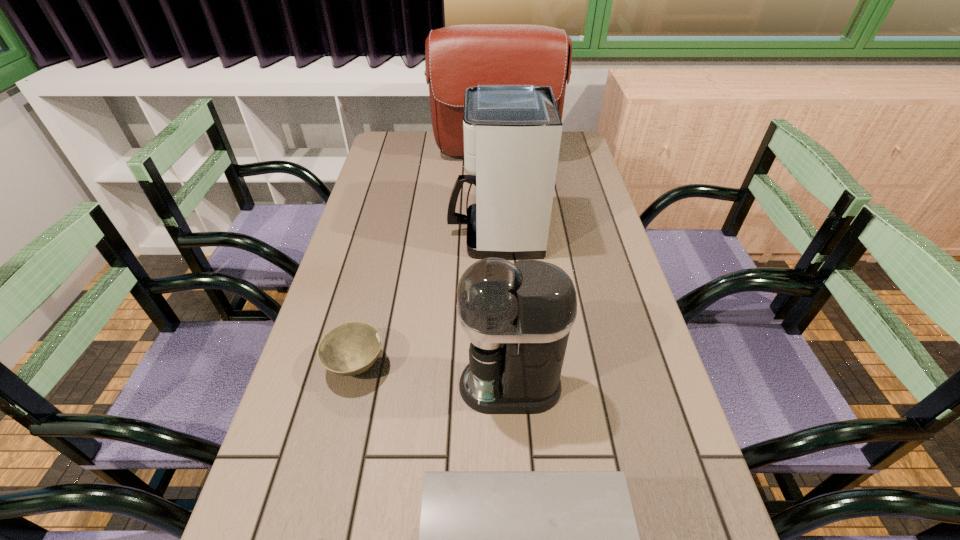
Find the location of a particular element. free region located on the front panel of the tallest coffee maker is located at coordinates (432, 235).

Locate an element on the screen. vacant space located place cup under the spout of the second tallest coffee maker is located at coordinates (356, 386).

Where is `vacant space located place cup under the spout of the second tallest coffee maker`? vacant space located place cup under the spout of the second tallest coffee maker is located at coordinates (403, 386).

This screenshot has width=960, height=540. What are the coordinates of `vacant space located place cup under the spout of the second tallest coffee maker` in the screenshot? It's located at (328, 386).

I want to click on vacant space located on the right of the bowl, so click(x=431, y=366).

The image size is (960, 540). Find the location of `object located at the far edge`. object located at the far edge is located at coordinates (457, 57).

The width and height of the screenshot is (960, 540). Find the location of `object that is at the left edge`. object that is at the left edge is located at coordinates (351, 348).

You are a GUI agent. You are given a task and a screenshot of the screen. Output one action in this format:
    pyautogui.click(x=<x>, y=<y>)
    Task: Click on the object that is positioned at the right edge
    The image size is (960, 540).
    Given the screenshot: What is the action you would take?
    pyautogui.click(x=457, y=57)

This screenshot has width=960, height=540. In order to click on object situated at the far right corner in this screenshot , I will do `click(457, 57)`.

This screenshot has width=960, height=540. Find the location of `vacant space at the left edge`. vacant space at the left edge is located at coordinates (402, 227).